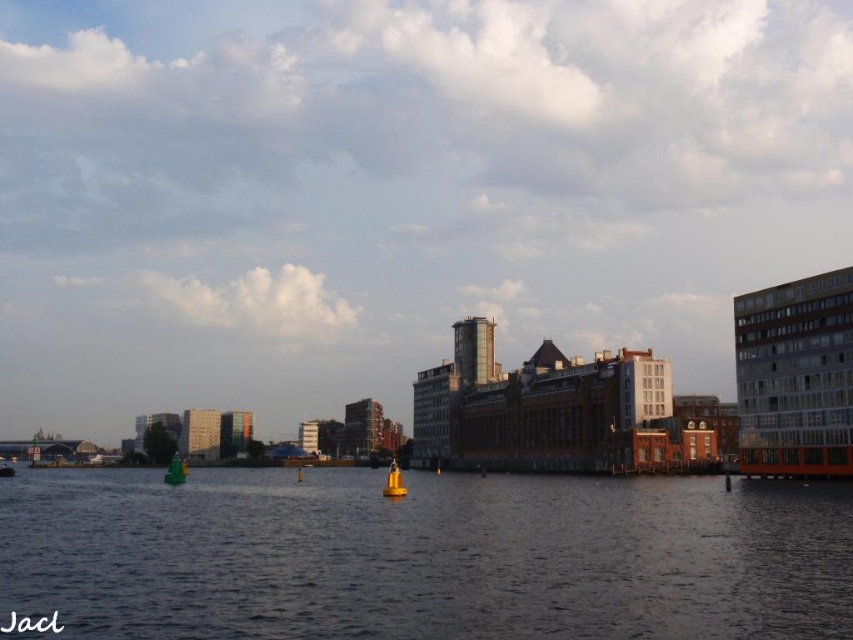
You are standing on a pier overlooking the dark blue water at center and the yellow matte buoy at center. Which object is nearer to you?

The dark blue water at center is closer to the viewer than the yellow matte buoy at center.

You are a boat operator who needs to determine which object is narrower between the yellow matte buoy at center and the green plastic boat at lower left. Which one is narrower?

The yellow matte buoy at center is thinner than the green plastic boat at lower left, so the yellow matte buoy at center is narrower.